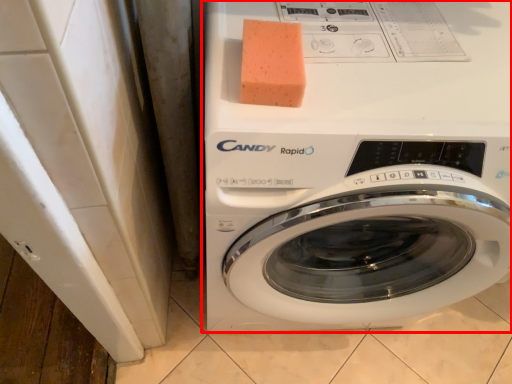
Question: Where is washing machine (annotated by the red box) located in relation to soap in the image?

Choices:
 (A) right
 (B) left

Answer: (A)